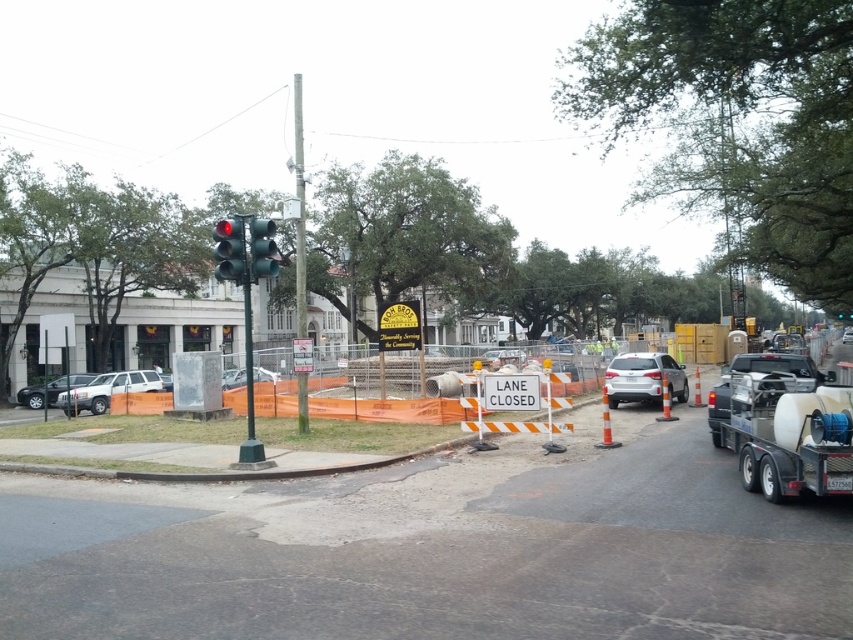
You are a pedestrian standing at the intersection and need to cross the street. There are two points marked on the road ahead of you. Which point is closer to you, point (149, 371) or point (227, 378)?

Point (149, 371) is closer to you because it is further to the viewer than point (227, 378).

You are a delivery driver approaching the intersection with a truck that has a height of 2 meters. There are two points marked on the road ahead. The first point is at coordinate point (114, 381) and the second point is at coordinate point (39, 387). Which point is closer to you as you drive towards the intersection?

Point (114, 381) is in front of point (39, 387), so the first point is closer to you as you drive towards the intersection.

You are a delivery driver approaching the intersection and see the white matte truck at right and the green matte traffic light at upper left. Which object is bigger in the image?

The white matte truck at right has a larger size compared to the green matte traffic light at upper left, so the white matte truck at right is bigger.